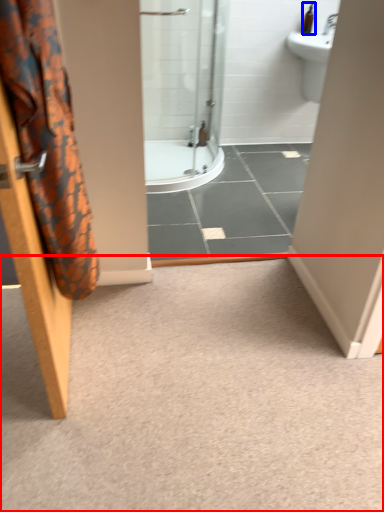
Question: Which point is closer to the camera, plain (highlighted by a red box) or toiletry (highlighted by a blue box)?

Choices:
 (A) plain
 (B) toiletry

Answer: (A)